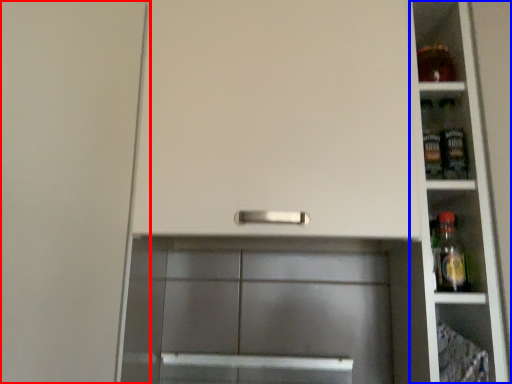
Question: Which point is closer to the camera, door (highlighted by a red box) or shelf (highlighted by a blue box)?

Choices:
 (A) door
 (B) shelf

Answer: (A)